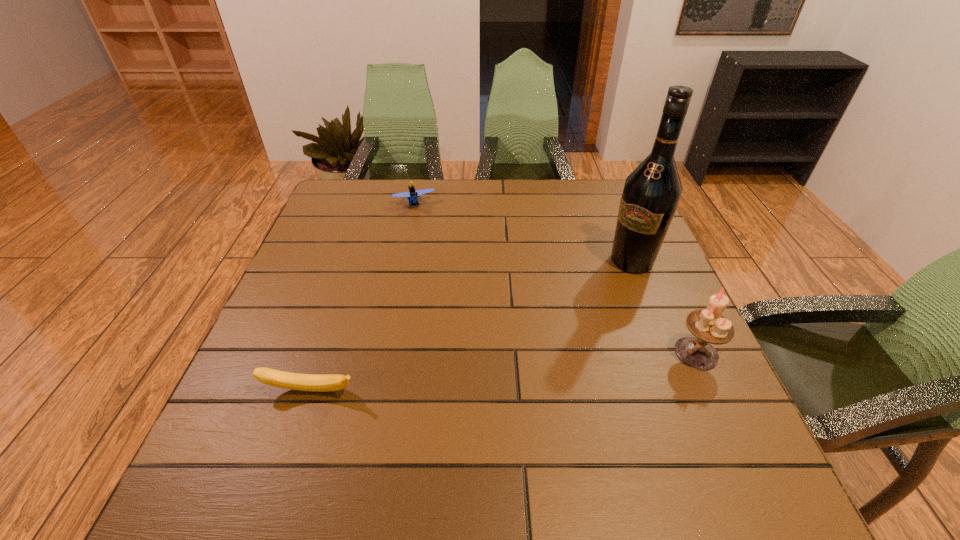
You are a GUI agent. You are given a task and a screenshot of the screen. Output one action in this format:
    pyautogui.click(x=<x>, y=<y>)
    Task: Click on the banana
    The height and width of the screenshot is (540, 960).
    Given the screenshot: What is the action you would take?
    pyautogui.click(x=303, y=382)

Identify the location of the third farthest object. (709, 326).

Identify the location of candle holder. Image resolution: width=960 pixels, height=540 pixels. (709, 326).

What are the coordinates of `wine bottle` in the screenshot? It's located at (651, 194).

This screenshot has width=960, height=540. What are the coordinates of `the second farthest object` in the screenshot? It's located at point(651,194).

Locate an element on the screen. The height and width of the screenshot is (540, 960). Lego is located at coordinates (412, 196).

Where is `vacant region located 0.050m at the stem of the banana`? This screenshot has width=960, height=540. vacant region located 0.050m at the stem of the banana is located at coordinates (300, 424).

Where is `free space located on the left of the third shortest object`? free space located on the left of the third shortest object is located at coordinates (570, 353).

Find the location of a particular element. The width and height of the screenshot is (960, 540). blank space located on the label of the second farthest object is located at coordinates (610, 289).

You are a GUI agent. You are given a task and a screenshot of the screen. Output one action in this format:
    pyautogui.click(x=<x>, y=<y>)
    Task: Click on the blank space located 0.150m on the label of the second farthest object
    
    Given the screenshot: What is the action you would take?
    pyautogui.click(x=594, y=308)